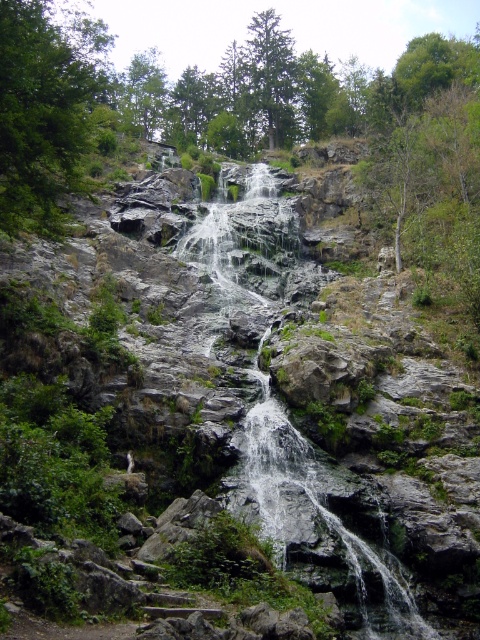
You are a hiker standing at the base of the gray stone waterfall at center and looking towards the green leafy tree at upper left. Which object appears taller in the scene?

The green leafy tree at upper left appears taller than the gray stone waterfall at center.

You are standing at the base of the gray stone waterfall at center and want to take a photo of the green matte tree at upper center. Since the waterfall is in front of the tree, will you be able to see the tree clearly in your photo?

The gray stone waterfall at center is in front of the green matte tree at upper center, so the waterfall may block your view of the tree, making it difficult to see the tree clearly in the photo.